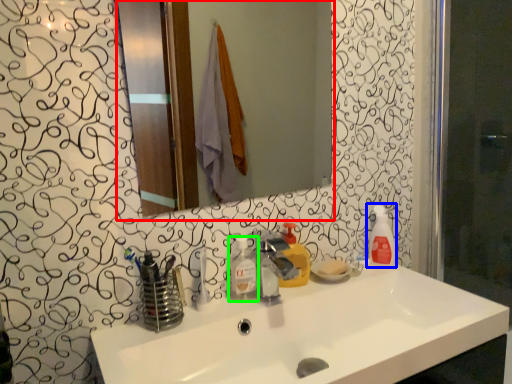
Question: Based on their relative distances, which object is nearer to mirror (highlighted by a red box)? Choose from cleaning product (highlighted by a blue box) and toiletry (highlighted by a green box).

Choices:
 (A) cleaning product
 (B) toiletry

Answer: (A)